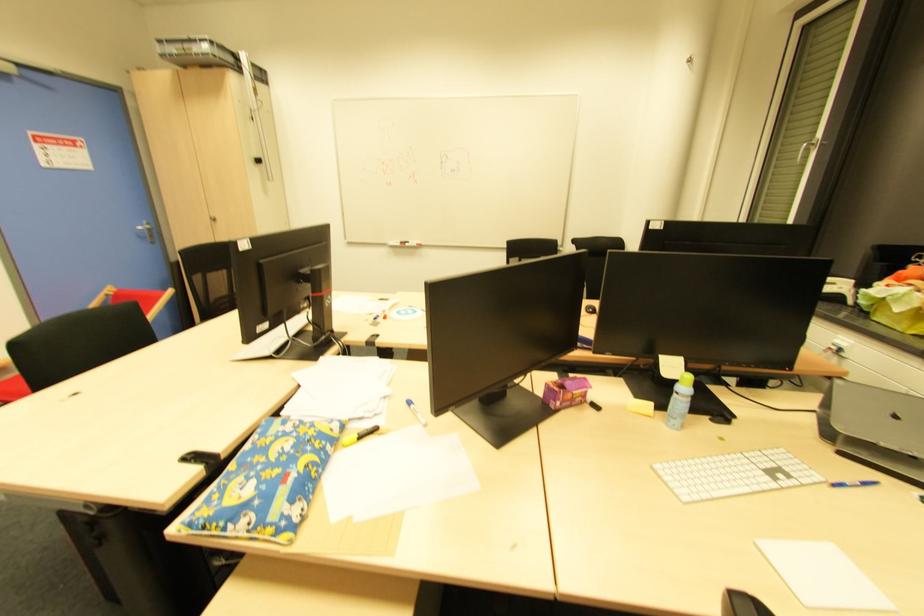
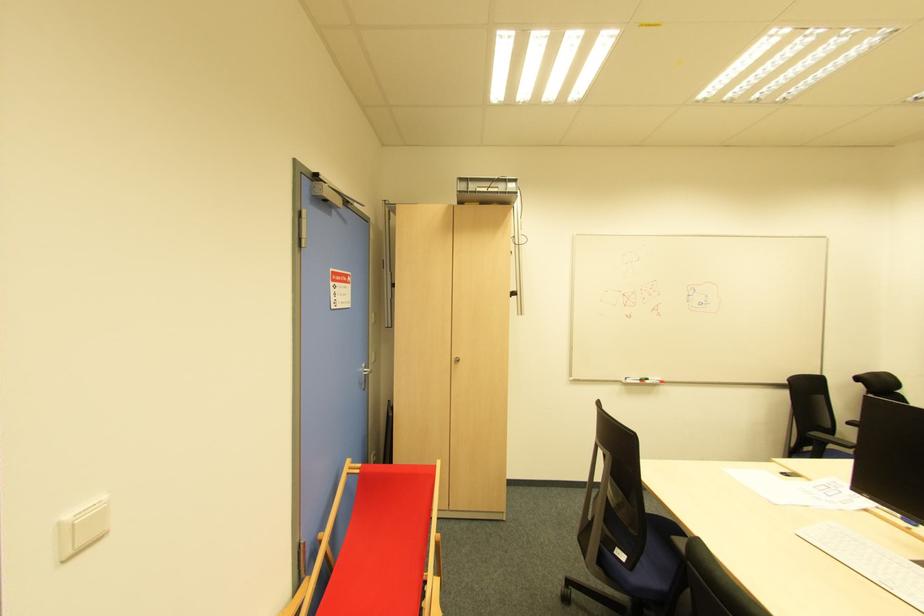
In the second image, find the point that corresponds to (x=152, y=238) in the first image.

(366, 382)